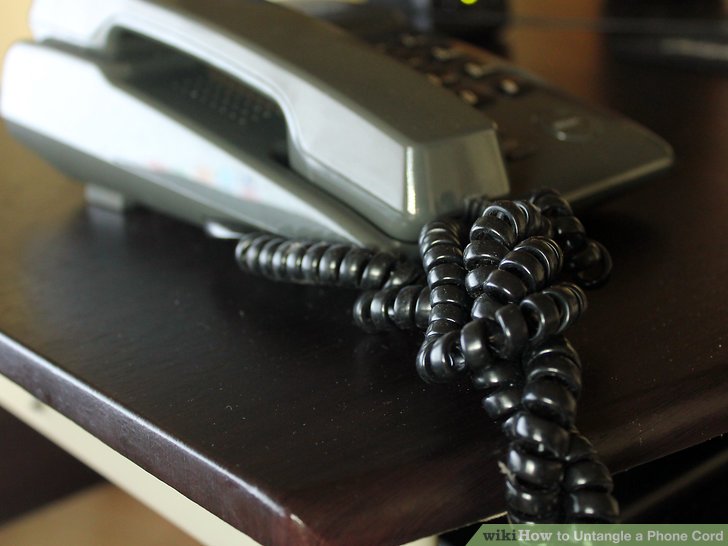
The height and width of the screenshot is (546, 728). What are the coordinates of `phone cord` in the screenshot? It's located at (451, 277).